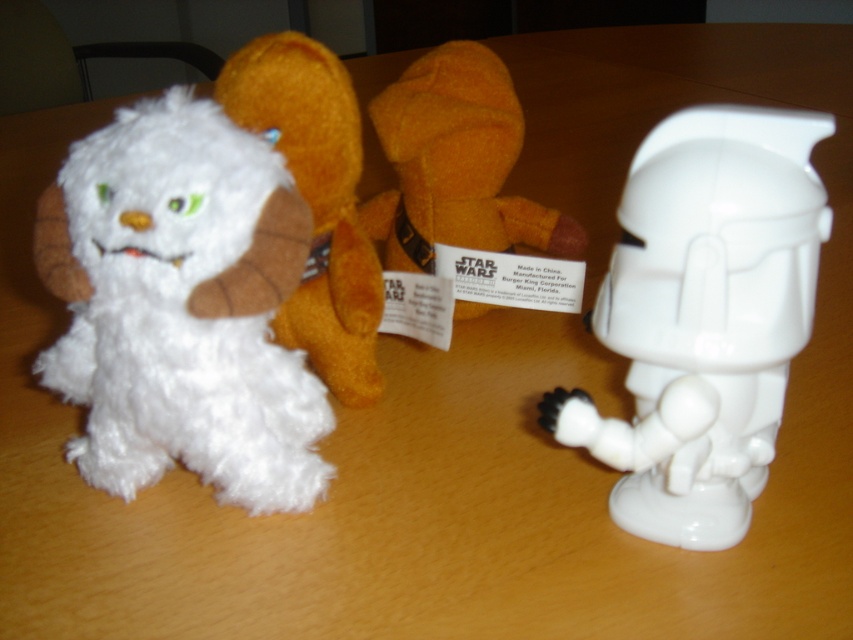
Can you confirm if white fluffy stuffed animal at left is positioned below white plush toy at upper left?

Yes, white fluffy stuffed animal at left is below white plush toy at upper left.

Is white fluffy stuffed animal at left shorter than white plush toy at upper left?

Yes, white fluffy stuffed animal at left is shorter than white plush toy at upper left.

Does point (141, 339) come in front of point (291, 157)?

Yes.

This screenshot has width=853, height=640. What are the coordinates of `white fluffy stuffed animal at left` in the screenshot? It's located at (181, 307).

Which is in front, point (282, 148) or point (431, 102)?

Positioned in front is point (282, 148).

Who is more forward, (311, 132) or (422, 148)?

Point (311, 132) is in front.

Find the location of a particular element. The image size is (853, 640). white plush toy at upper left is located at coordinates (316, 202).

Can you confirm if white fluffy stuffed animal at left is bigger than orange plush toy at center?

Yes, white fluffy stuffed animal at left is bigger than orange plush toy at center.

Does white fluffy stuffed animal at left appear on the left side of orange plush toy at center?

Indeed, white fluffy stuffed animal at left is positioned on the left side of orange plush toy at center.

Image resolution: width=853 pixels, height=640 pixels. Describe the element at coordinates (181, 307) in the screenshot. I see `white fluffy stuffed animal at left` at that location.

The width and height of the screenshot is (853, 640). In order to click on white fluffy stuffed animal at left in this screenshot , I will do `click(181, 307)`.